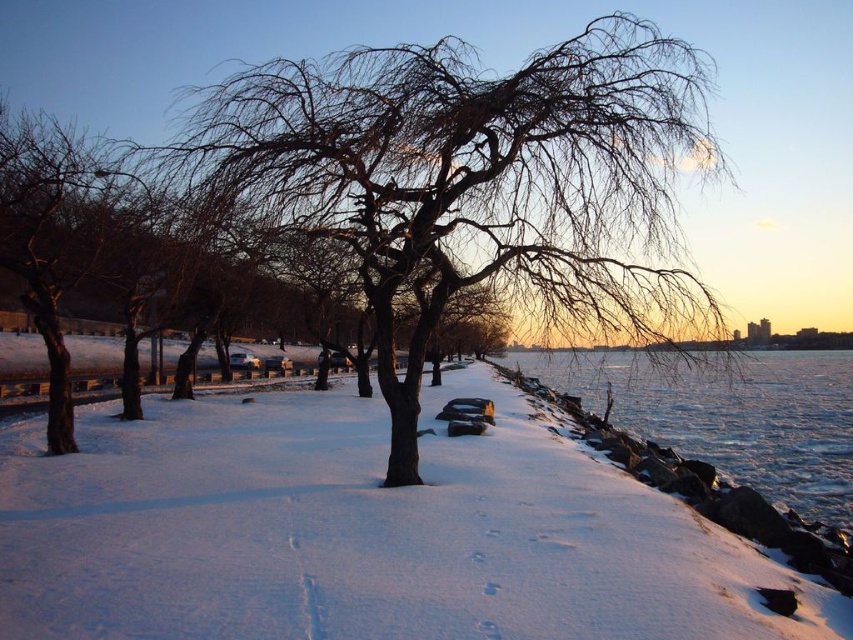
Does point (183, 582) come farther from viewer compared to point (722, 170)?

No, (183, 582) is closer to viewer.

Measure the distance between white powdery snow at center and bare branches at center.

They are 5.41 meters apart.

Between point (299, 499) and point (216, 147), which one is positioned in front?

Positioned in front is point (216, 147).

I want to click on white powdery snow at center, so click(363, 532).

Is point (434, 64) behind point (785, 490)?

No.

Between point (318, 108) and point (827, 408), which one is positioned behind?

Positioned behind is point (827, 408).

The image size is (853, 640). What are the coordinates of `bare branches at center` in the screenshot? It's located at point(477,180).

Locate an element on the screen. Image resolution: width=853 pixels, height=640 pixels. white powdery snow at center is located at coordinates (363, 532).

Is white powdery snow at center above frozen ice at lower right?

Yes, white powdery snow at center is above frozen ice at lower right.

The height and width of the screenshot is (640, 853). I want to click on white powdery snow at center, so click(x=363, y=532).